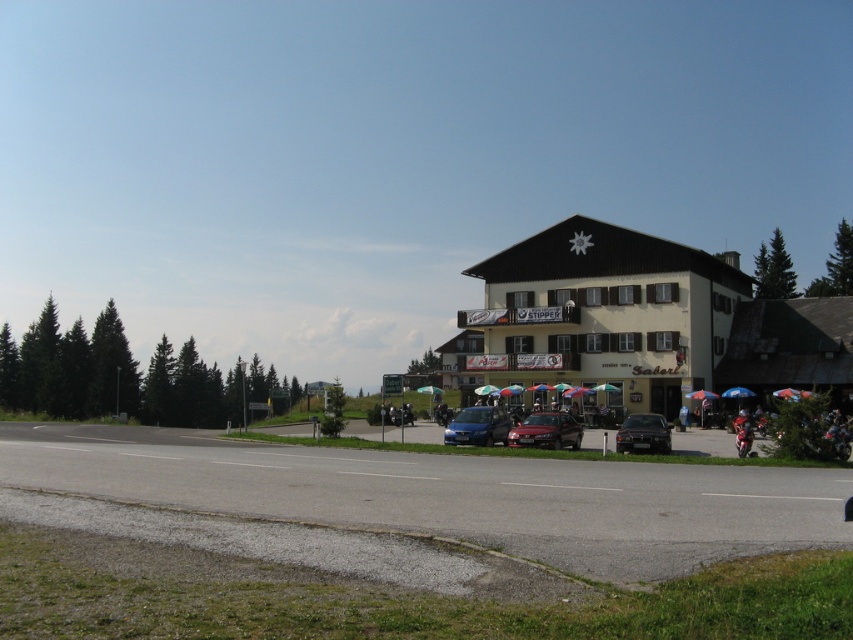
Does green textured pine at left have a greater height compared to metallic red motorcycle at lower right?

Yes.

Between point (160, 400) and point (747, 428), which one is positioned in front?

Point (747, 428)

The height and width of the screenshot is (640, 853). I want to click on green textured pine at left, so click(x=128, y=376).

Does matte blue car at center have a greater height compared to matte black car at center?

Yes, matte blue car at center is taller than matte black car at center.

Who is positioned more to the right, matte blue car at center or matte black car at center?

Positioned to the right is matte black car at center.

Between point (447, 442) and point (683, 422), which one is positioned in front?

Point (447, 442) is more forward.

I want to click on matte blue car at center, so click(x=479, y=426).

Consider the image. Who is more distant from viewer, (556, 426) or (779, 228)?

Positioned behind is point (779, 228).

Between satin silver sedan at center and green textured pine at upper right, which one is positioned higher?

Positioned higher is green textured pine at upper right.

Is point (521, 435) farther from viewer compared to point (772, 262)?

No.

Where is `satin silver sedan at center`? This screenshot has width=853, height=640. satin silver sedan at center is located at coordinates (546, 432).